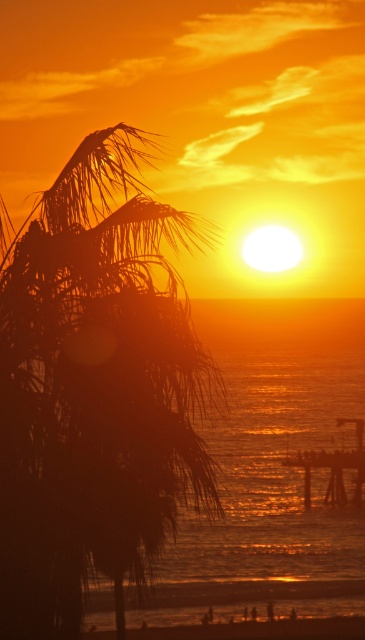
Question: Is silhouette leafy palm at left wider than glistening metallic water at center?

Choices:
 (A) no
 (B) yes

Answer: (A)

Question: Estimate the real-world distances between objects in this image. Which object is closer to the silhouette leafy palm at left?

Choices:
 (A) glistening metallic water at center
 (B) wooden pier at center

Answer: (A)

Question: Does silhouette leafy palm at left have a greater width compared to wooden pier at center?

Choices:
 (A) no
 (B) yes

Answer: (A)

Question: Does glistening metallic water at center come in front of wooden pier at center?

Choices:
 (A) no
 (B) yes

Answer: (B)

Question: Which point is farther to the camera?

Choices:
 (A) (337, 500)
 (B) (259, 420)
 (C) (162, 461)

Answer: (B)

Question: Which of these objects is positioned farthest from the silhouette leafy palm at left?

Choices:
 (A) glistening metallic water at center
 (B) wooden pier at center

Answer: (B)